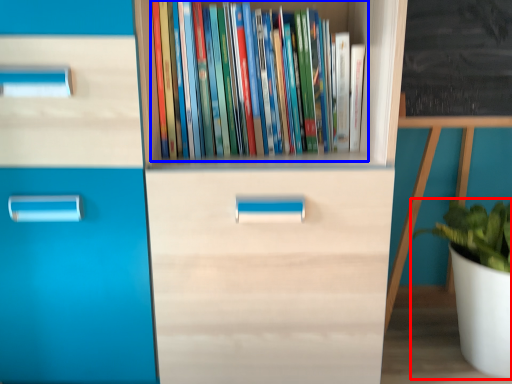
Question: Among these objects, which one is farthest to the camera, houseplant (highlighted by a red box) or book (highlighted by a blue box)?

Choices:
 (A) houseplant
 (B) book

Answer: (A)